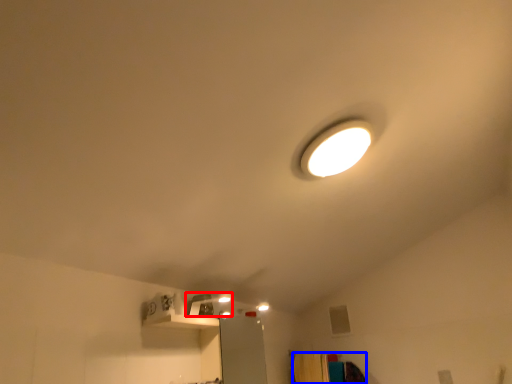
Question: Among these objects, which one is farthest to the camera, lamp (highlighted by a red box) or furniture (highlighted by a blue box)?

Choices:
 (A) lamp
 (B) furniture

Answer: (B)